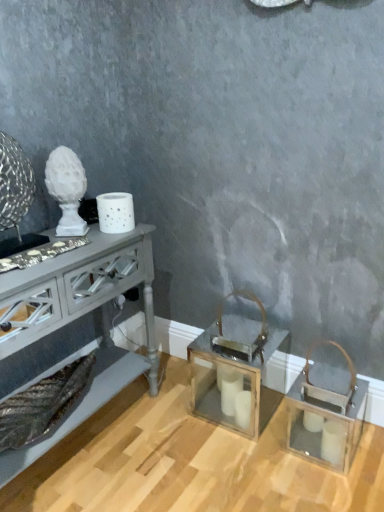
Where is `free location to the right of matte gray console table at left, which is the first table in left-to-right order`? free location to the right of matte gray console table at left, which is the first table in left-to-right order is located at coordinates (178, 448).